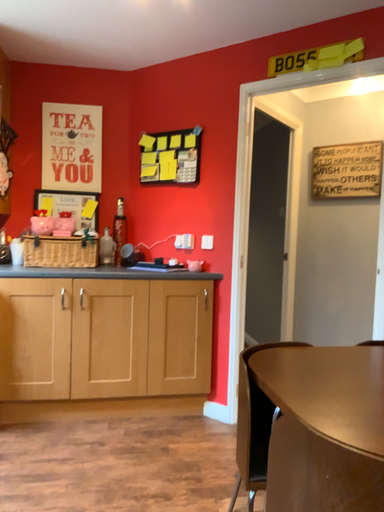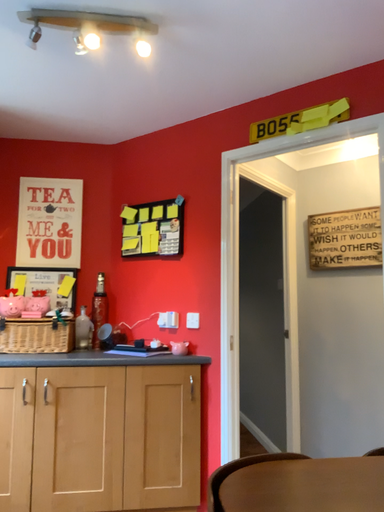
Question: How did the camera likely rotate when shooting the video?

Choices:
 (A) rotated downward
 (B) rotated upward

Answer: (B)